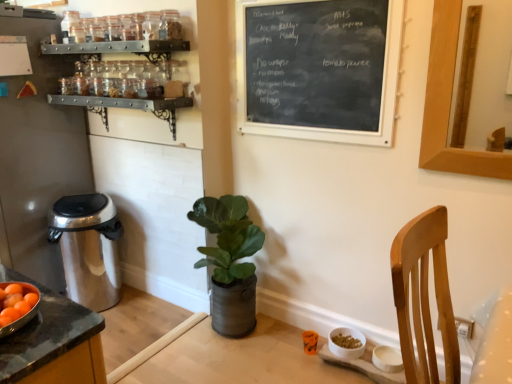
Where is `vacant space to the right of satin silver trash can at left`? The image size is (512, 384). vacant space to the right of satin silver trash can at left is located at coordinates (148, 311).